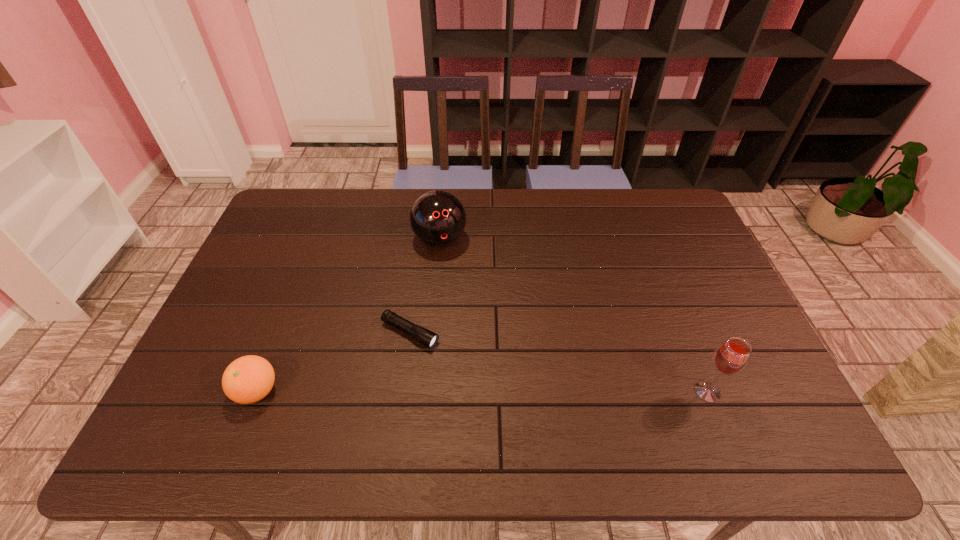
The height and width of the screenshot is (540, 960). What are the coordinates of `free spot that satisfies the following two spatial constraints: 1. on the back side of the flashlight; 2. on the left side of the orange` in the screenshot? It's located at (279, 333).

Where is `free location that satisfies the following two spatial constraints: 1. on the back side of the farthest object; 2. on the right side of the second shortest object`? free location that satisfies the following two spatial constraints: 1. on the back side of the farthest object; 2. on the right side of the second shortest object is located at coordinates (316, 240).